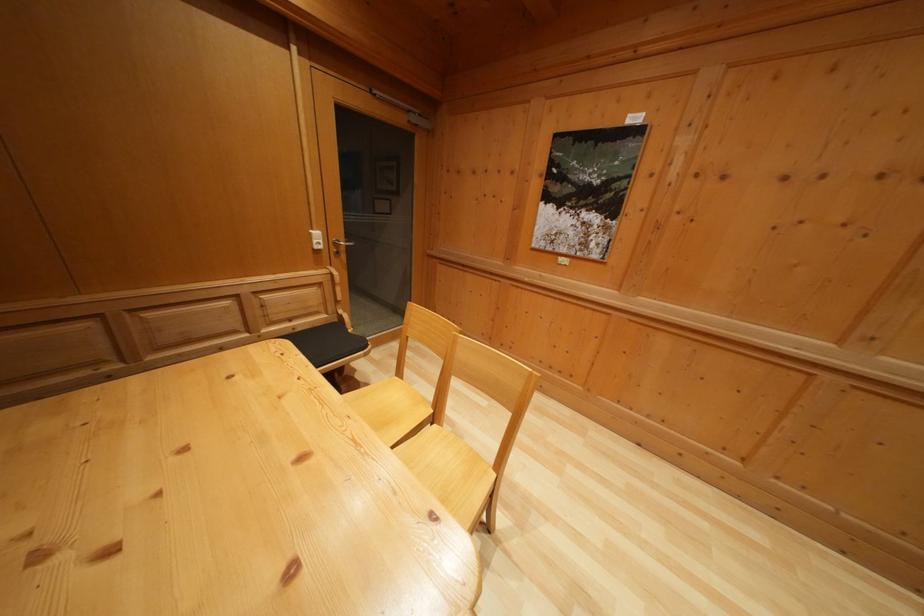
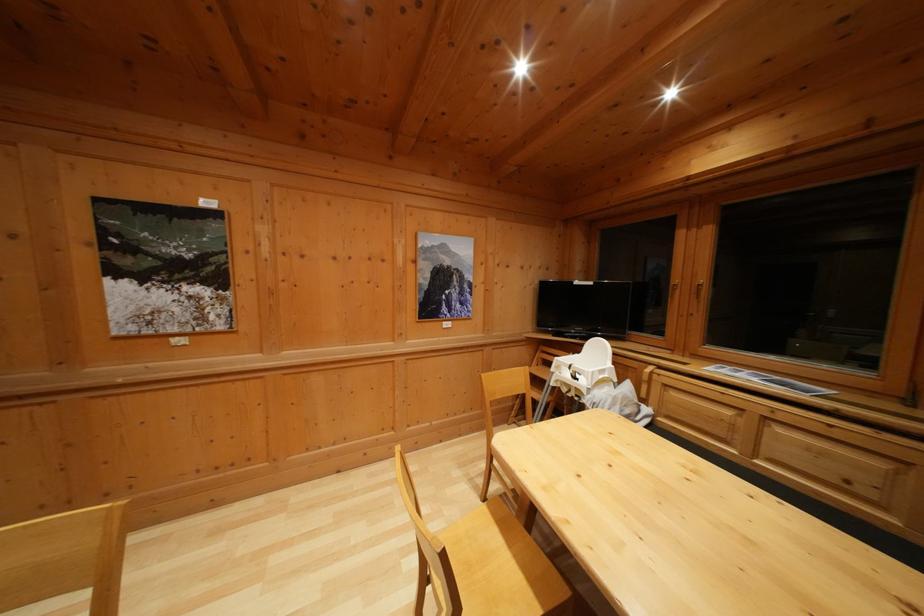
Question: The camera is either moving clockwise (left) or counter-clockwise (right) around the object. The first image is from the beginning of the video and the second image is from the end. Is the camera moving left or right when shooting the video?

Choices:
 (A) Left
 (B) Right

Answer: (A)